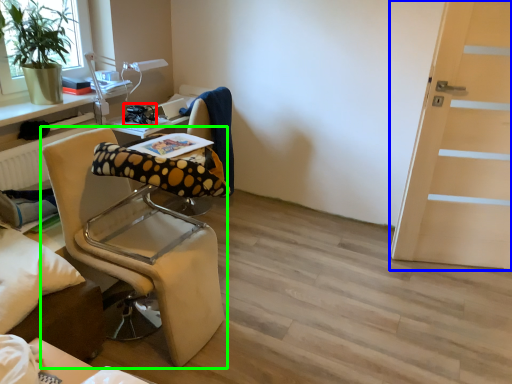
Question: Which object is the closest to the equipment (highlighted by a red box)? Choose among these: door (highlighted by a blue box) or chair (highlighted by a green box).

Choices:
 (A) door
 (B) chair

Answer: (B)